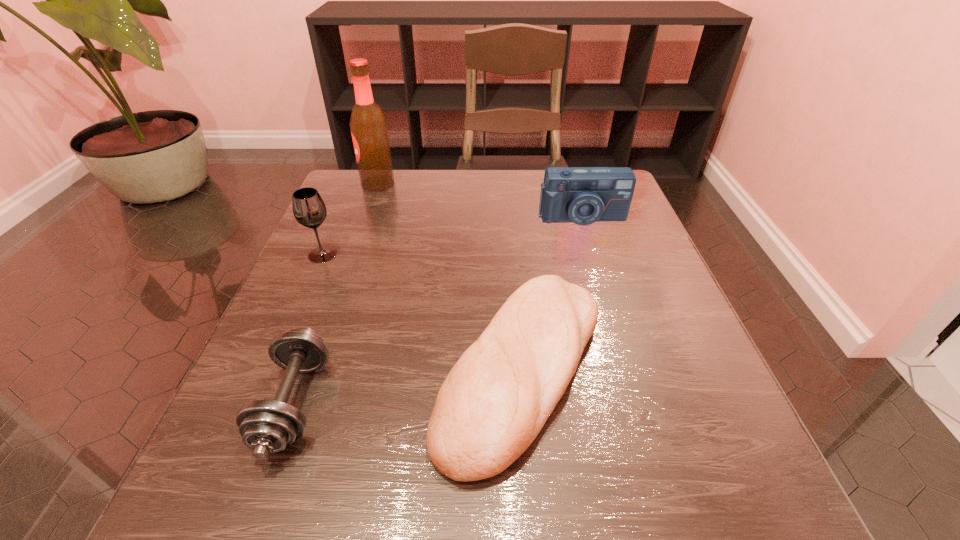
You are a GUI agent. You are given a task and a screenshot of the screen. Output one action in this format:
    pyautogui.click(x=<x>, y=<y>)
    Task: Click on the farthest object
    
    Given the screenshot: What is the action you would take?
    pyautogui.click(x=368, y=125)

Where is `beer bottle`? The image size is (960, 540). beer bottle is located at coordinates (368, 125).

Identify the location of the second tallest object. This screenshot has width=960, height=540. (309, 209).

Locate an element on the screen. the third farthest object is located at coordinates (309, 209).

The width and height of the screenshot is (960, 540). I want to click on the third tallest object, so click(x=583, y=195).

Where is `the fourth nearest object`? the fourth nearest object is located at coordinates (583, 195).

Where is `bread`? bread is located at coordinates (495, 400).

Identify the location of dumbbell. The image size is (960, 540). (267, 426).

What are the coordinates of `free space located 0.080m on the front of the farthest object` in the screenshot? It's located at (370, 210).

In order to click on vacant area located on the front of the wineglass in this screenshot , I will do `click(246, 430)`.